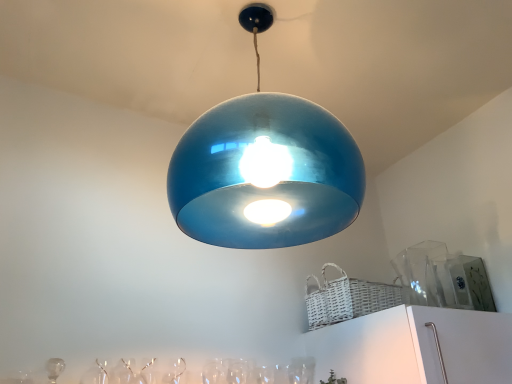
This screenshot has height=384, width=512. Describe the element at coordinates (265, 174) in the screenshot. I see `shiny blue dome at center` at that location.

Image resolution: width=512 pixels, height=384 pixels. In order to click on shiny blue dome at center in this screenshot , I will do `click(265, 174)`.

What is the approximate width of shiny blue dome at center?

The width of shiny blue dome at center is 21.35 inches.

Where is `shiny blue dome at center`? shiny blue dome at center is located at coordinates (265, 174).